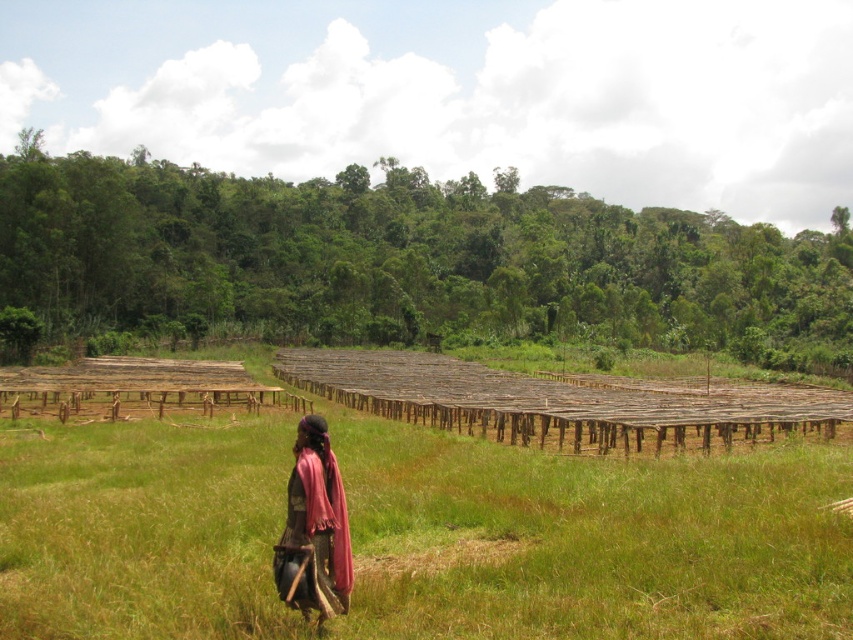
You are a photographer trying to capture the brown wooden racks at center and the dark brown fabric at center in the same frame. Based on their positions, which object should you adjust your camera to focus on first to ensure both are in the shot?

The brown wooden racks at center is positioned on the left side of dark brown fabric at center, so you should focus on the brown wooden racks at center first to ensure both are in the frame.

You are a hiker who wants to cross from the left side of the field to the right side. There are brown wooden racks at center and dark brown fabric at center in the way. Can you walk between them without needing to detour around them?

The brown wooden racks at center and dark brown fabric at center are 9.24 meters apart, so yes, you can walk between them without needing to detour around them since the distance is sufficient for passage.

You are standing at the origin point of the image coordinate system. The brown wooden racks at center are located at point 0.842, 0.693. If you want to walk towards them, in which direction should you move?

You should move towards the point (590, 538) to reach the brown wooden racks at center.